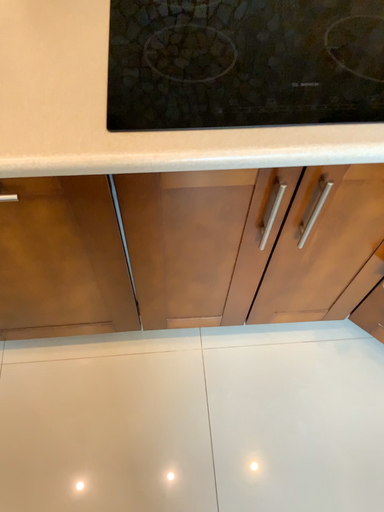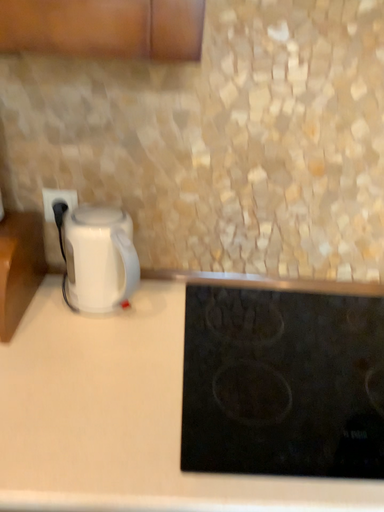
Question: Which way did the camera rotate in the video?

Choices:
 (A) rotated downward
 (B) rotated upward

Answer: (B)